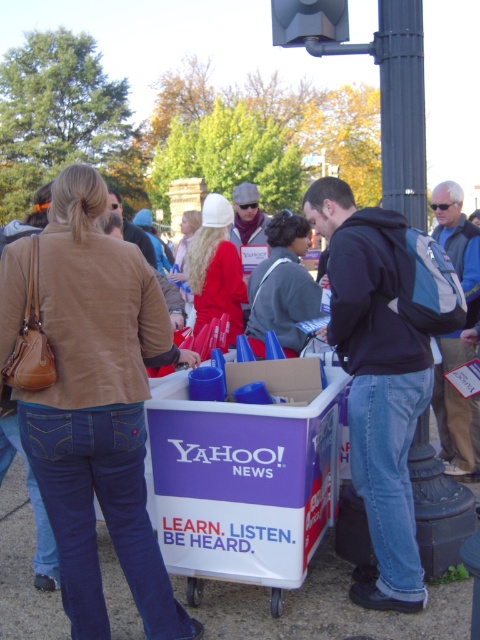
You are organizing an outdoor event and need to place both the purple cardboard cart at center and the black matte backpack at center along a narrow walkway. Given their sizes, which object should be placed first to ensure they both fit without overlapping?

The purple cardboard cart at center should be placed first because its width is larger than the black matte backpack at center, so positioning the wider object first ensures there is enough space for both along the narrow walkway.

You are a delivery person who needs to place a 3.5 feet wide package between the purple cardboard cart at center and the black matte backpack at center. Can you fit the package between them?

The distance between the purple cardboard cart at center and the black matte backpack at center is 3.62 feet, so the 3.5 feet wide package can fit between them as there is enough space.